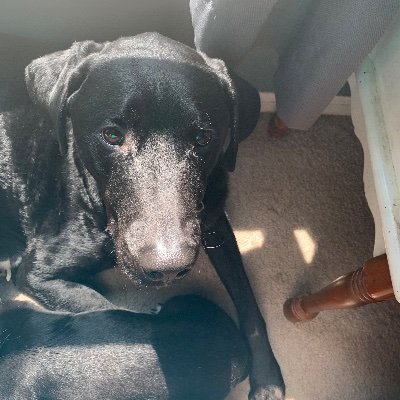
This screenshot has width=400, height=400. Identify the location of curtain. (300, 32).